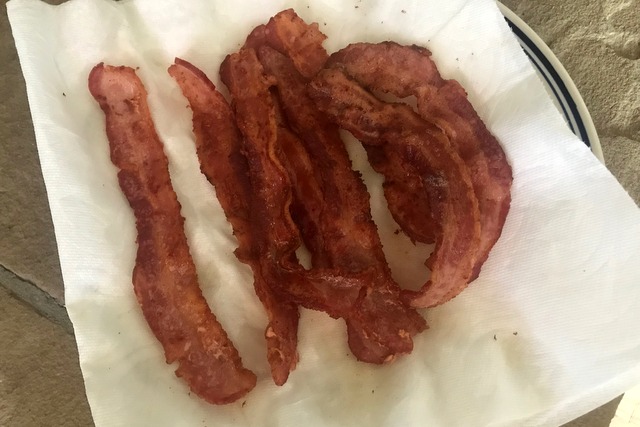
Image resolution: width=640 pixels, height=427 pixels. What are the coordinates of `table` in the screenshot? It's located at (584, 77).